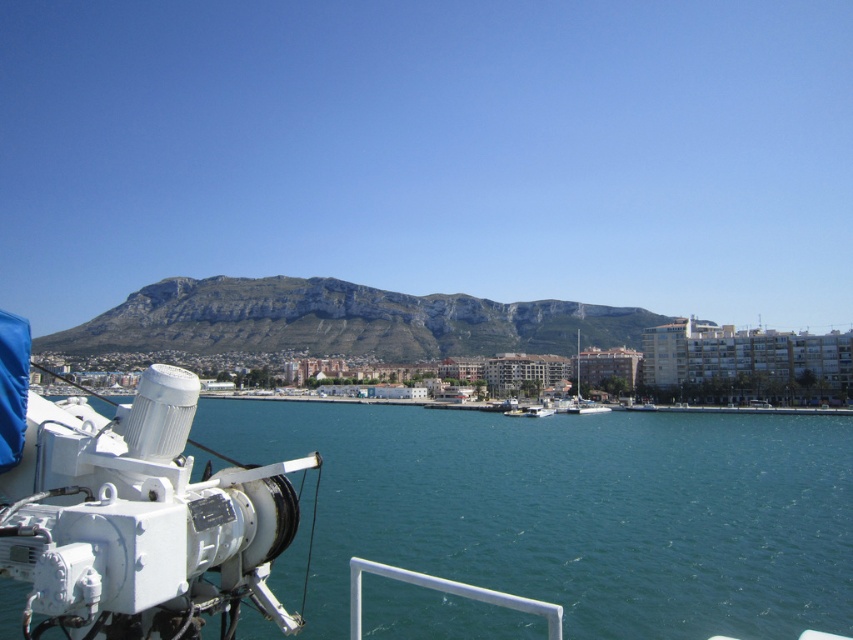
Question: Can you confirm if clear blue water at lower left is wider than rugged stone mountain at center?

Choices:
 (A) yes
 (B) no

Answer: (B)

Question: Is clear blue water at lower left to the left of rugged stone mountain at center from the viewer's perspective?

Choices:
 (A) no
 (B) yes

Answer: (A)

Question: From the image, what is the correct spatial relationship of clear blue water at lower left in relation to rugged stone mountain at center?

Choices:
 (A) right
 (B) left

Answer: (A)

Question: Which object is positioned farthest from the rugged stone mountain at center?

Choices:
 (A) clear blue water at lower left
 (B) white matte sailboat at center

Answer: (A)

Question: Among these points, which one is nearest to the camera?

Choices:
 (A) (625, 531)
 (B) (590, 404)
 (C) (608, 340)

Answer: (A)

Question: Based on their relative distances, which object is nearer to the clear blue water at lower left?

Choices:
 (A) white matte sailboat at center
 (B) rugged stone mountain at center

Answer: (A)